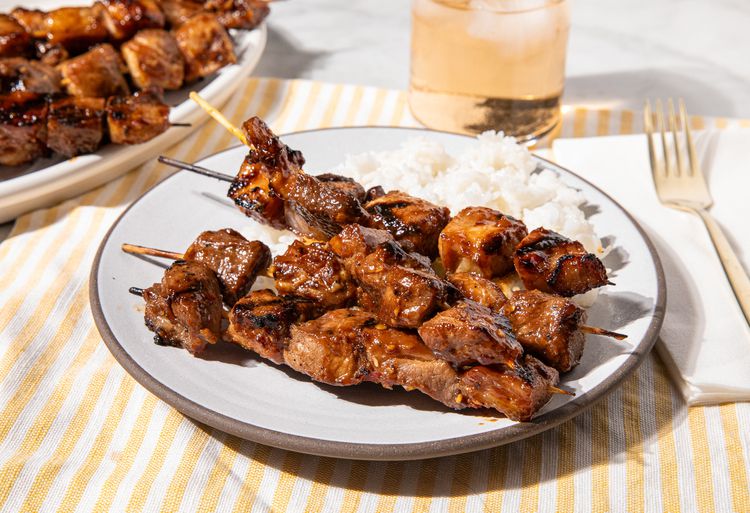
At what (x,y) coordinates should I click in order to perform the action: click on fork. Please return your answer as a coordinate pair (x, y). This screenshot has height=513, width=750. Looking at the image, I should click on (690, 186).